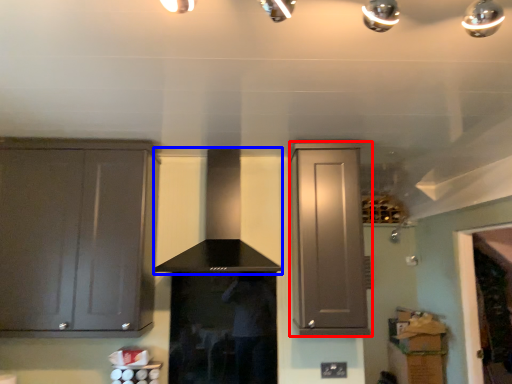
Question: Which object is closer to the camera taking this photo, cabinetry (highlighted by a red box) or vent (highlighted by a blue box)?

Choices:
 (A) cabinetry
 (B) vent

Answer: (B)